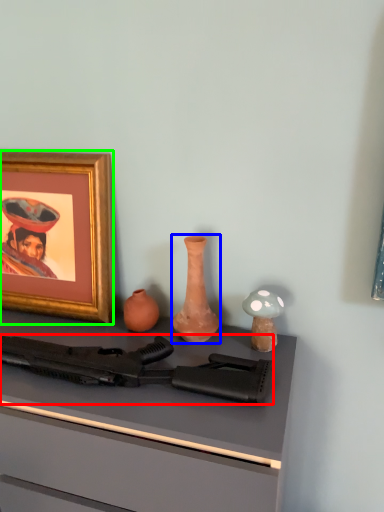
Question: Estimate the real-world distances between objects in this image. Which object is closer to rifle (highlighted by a red box), vase (highlighted by a blue box) or picture frame (highlighted by a green box)?

Choices:
 (A) vase
 (B) picture frame

Answer: (A)